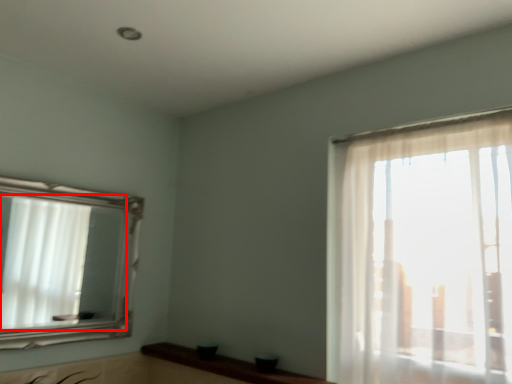
Question: From the image's perspective, where is mirror (annotated by the red box) located relative to counter top?

Choices:
 (A) below
 (B) above

Answer: (B)